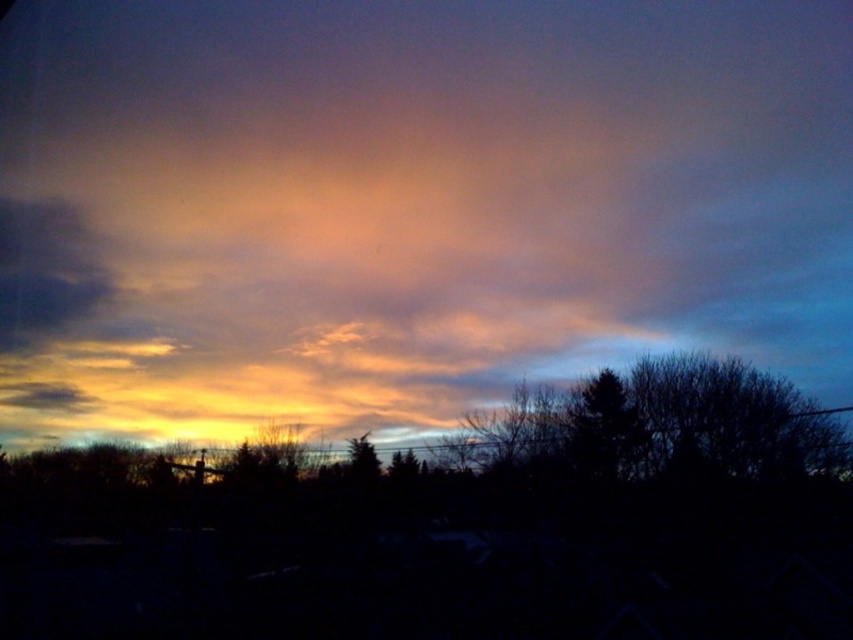
Question: Does cloudy sky at upper center lie behind silhouette bare tree at center?

Choices:
 (A) no
 (B) yes

Answer: (B)

Question: Is cloudy sky at upper center wider than silhouette bare tree at center?

Choices:
 (A) no
 (B) yes

Answer: (B)

Question: Can you confirm if cloudy sky at upper center is smaller than silhouette bare tree at center?

Choices:
 (A) yes
 (B) no

Answer: (B)